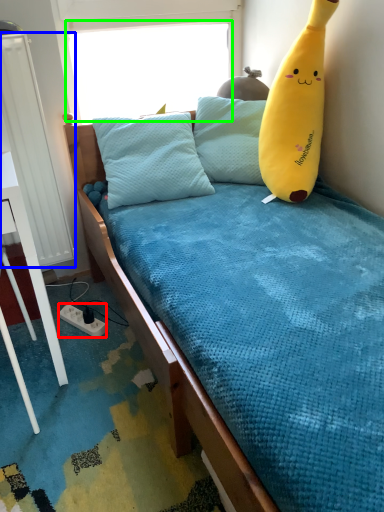
Question: Which is farther away from power outlet (highlighted by a red box)? radiator (highlighted by a blue box) or window screen (highlighted by a green box)?

Choices:
 (A) radiator
 (B) window screen

Answer: (B)